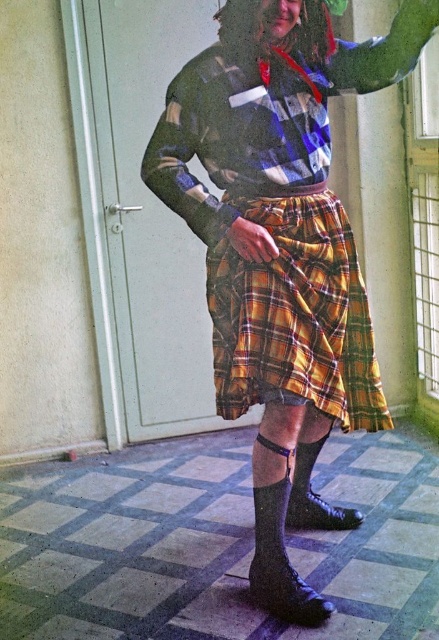
Can you confirm if yellow plaid skirt at center is positioned to the right of black matte sock at lower center?

No, yellow plaid skirt at center is not to the right of black matte sock at lower center.

Does yellow plaid skirt at center have a lesser width compared to black matte sock at lower center?

Incorrect, yellow plaid skirt at center's width is not less than black matte sock at lower center's.

Who is more distant from viewer, (164,148) or (313,456)?

Point (313,456)

Identify the location of yellow plaid skirt at center. The image size is (439, 640). (280, 241).

Is point (269, 486) farther from camera compared to point (355, 516)?

No, it is in front of (355, 516).

Which of these two, black suede sock at lower center or black matte sock at lower center, stands taller?

With more height is black suede sock at lower center.

Based on the photo, who is more distant from viewer, (280, 600) or (303, 461)?

The point (303, 461) is behind.

Where is `black suede sock at lower center`? black suede sock at lower center is located at coordinates (280, 563).

This screenshot has width=439, height=640. Describe the element at coordinates (295, 316) in the screenshot. I see `yellow plaid kilt at center` at that location.

The height and width of the screenshot is (640, 439). Describe the element at coordinates (295, 316) in the screenshot. I see `yellow plaid kilt at center` at that location.

At what (x,y) coordinates should I click in order to perform the action: click on yellow plaid kilt at center. Please return your answer as a coordinate pair (x, y). Looking at the image, I should click on (295, 316).